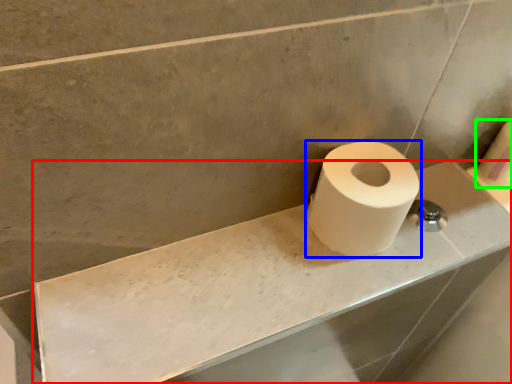
Question: Which is nearer to the counter top (highlighted by a red box)? toilet paper (highlighted by a blue box) or toilet paper (highlighted by a green box).

Choices:
 (A) toilet paper
 (B) toilet paper

Answer: (A)